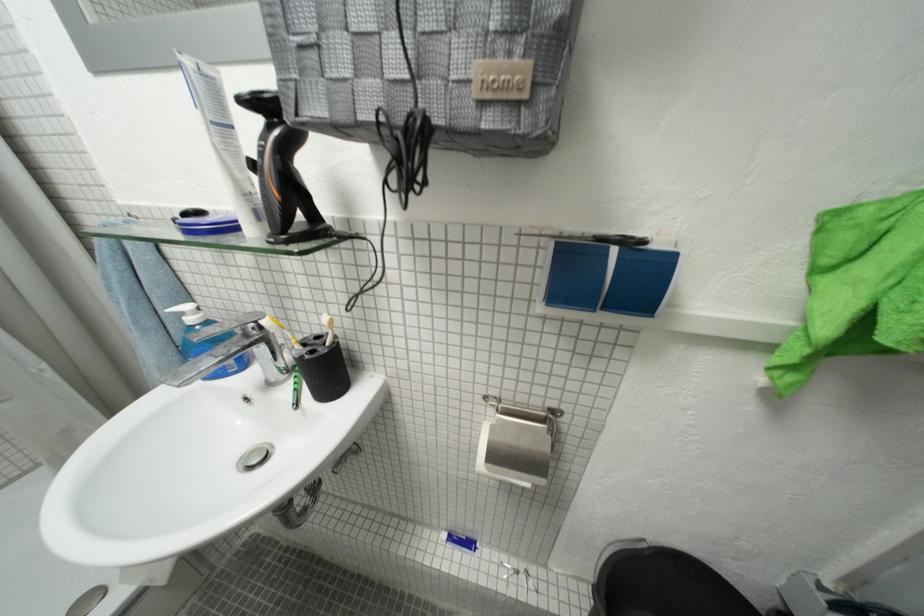
This screenshot has height=616, width=924. Identify the location of soap dispenser pump. (188, 313).